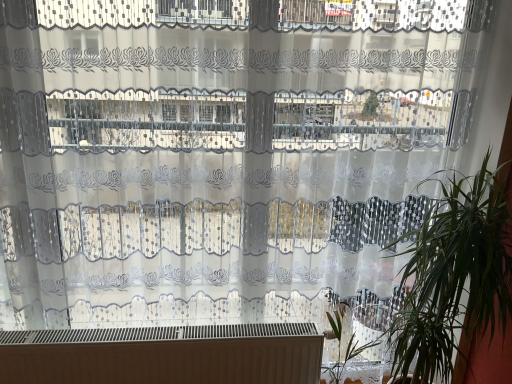
Question: Is green leafy plant at right bigger than white matte heater at bottom?

Choices:
 (A) no
 (B) yes

Answer: (B)

Question: Can you confirm if green leafy plant at right is shorter than white matte heater at bottom?

Choices:
 (A) yes
 (B) no

Answer: (B)

Question: Does green leafy plant at right come in front of white matte heater at bottom?

Choices:
 (A) no
 (B) yes

Answer: (B)

Question: Considering the relative sizes of green leafy plant at right and white matte heater at bottom in the image provided, is green leafy plant at right wider than white matte heater at bottom?

Choices:
 (A) yes
 (B) no

Answer: (A)

Question: Considering the relative sizes of green leafy plant at right and white matte heater at bottom in the image provided, is green leafy plant at right smaller than white matte heater at bottom?

Choices:
 (A) no
 (B) yes

Answer: (A)

Question: In the image, is white matte heater at bottom on the left side or the right side of green leafy plant at lower right?

Choices:
 (A) left
 (B) right

Answer: (A)

Question: From their relative heights in the image, would you say white matte heater at bottom is taller or shorter than green leafy plant at lower right?

Choices:
 (A) tall
 (B) short

Answer: (B)

Question: Looking at the image, does white matte heater at bottom seem bigger or smaller compared to green leafy plant at lower right?

Choices:
 (A) big
 (B) small

Answer: (A)

Question: Relative to green leafy plant at lower right, is white matte heater at bottom in front or behind?

Choices:
 (A) front
 (B) behind

Answer: (B)

Question: In terms of size, does green leafy plant at lower right appear bigger or smaller than white matte heater at bottom?

Choices:
 (A) big
 (B) small

Answer: (B)

Question: Choose the correct answer: Is green leafy plant at lower right inside white matte heater at bottom or outside it?

Choices:
 (A) inside
 (B) outside

Answer: (B)

Question: Based on their positions, is green leafy plant at lower right located to the left or right of white matte heater at bottom?

Choices:
 (A) right
 (B) left

Answer: (A)

Question: Is green leafy plant at lower right wider or thinner than white matte heater at bottom?

Choices:
 (A) thin
 (B) wide

Answer: (B)

Question: From a real-world perspective, is white matte heater at bottom physically located above or below green leafy plant at right?

Choices:
 (A) below
 (B) above

Answer: (A)

Question: Considering their positions, is white matte heater at bottom located in front of or behind green leafy plant at right?

Choices:
 (A) behind
 (B) front

Answer: (A)